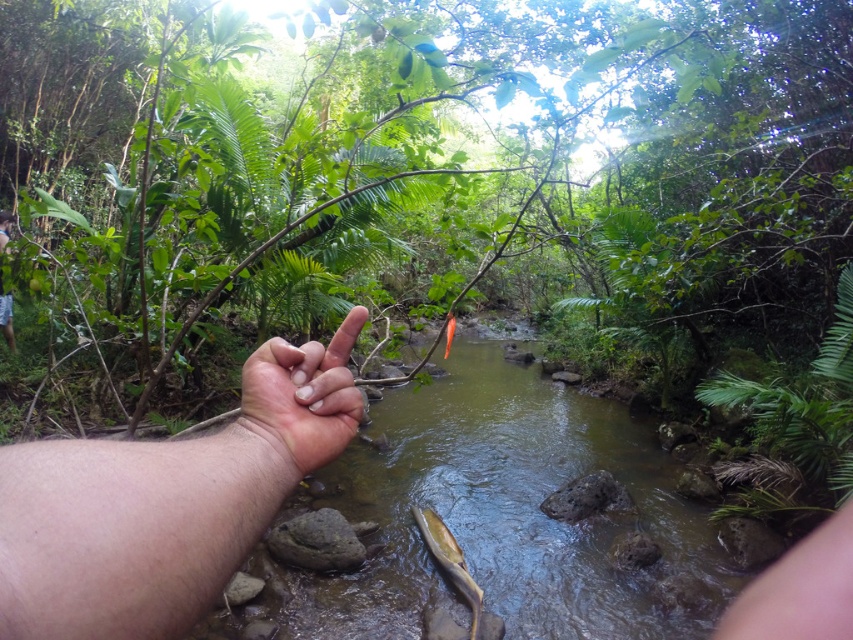
You are a photographer trying to capture both the skinny flesh at center and the orange matte fish at center in a single shot. Based on their sizes, which object should you focus on first to ensure both are in frame?

The skinny flesh at center is shorter than the orange matte fish at center, so you should focus on the orange matte fish at center first to ensure both are in frame.

You are a photographer trying to capture the peace sign gesture made by the hand in the scene. The point representing the skinny flesh at center is located at coordinate point (x=164, y=502). If you want to focus on this point, which part of the hand should you adjust your camera to aim at?

The point (x=164, y=502) corresponds to the skinny flesh at center, so you should aim your camera at the skinny flesh at center to focus on this point.

You are standing by the stream and want to place your hand in the water. Based on the scene, where is the pale skin at center in relation to the clear water at stream center?

The pale skin at center is above the clear water at stream center, so placing your hand in the water would require moving it downward from its current position.